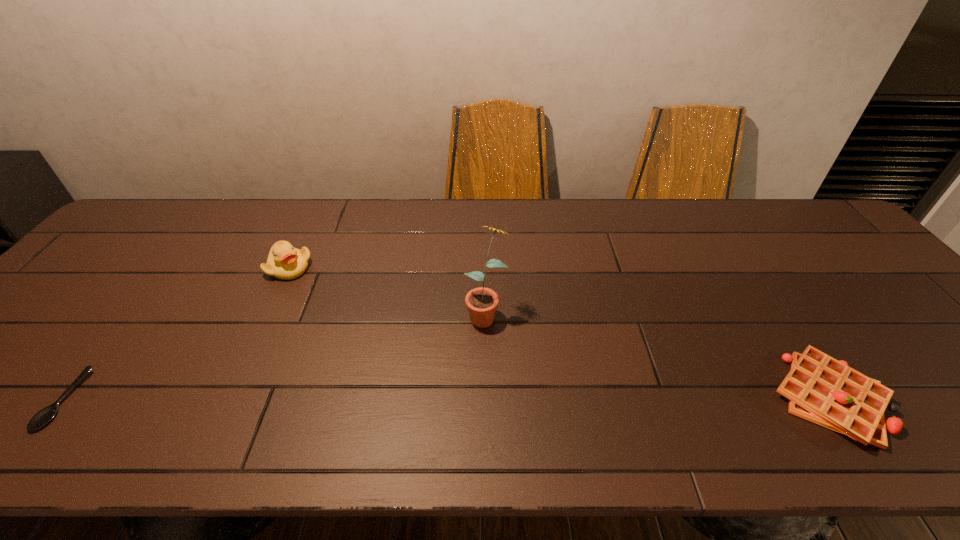
Image resolution: width=960 pixels, height=540 pixels. What are the coordinates of `the leftmost object` in the screenshot? It's located at (41, 418).

This screenshot has height=540, width=960. What are the coordinates of `the shortest object` in the screenshot? It's located at (41, 418).

The height and width of the screenshot is (540, 960). Find the location of `the rightmost object`. the rightmost object is located at coordinates (821, 389).

At what (x,y) coordinates should I click in order to perform the action: click on waffle. Please return your answer as a coordinate pair (x, y). This screenshot has height=540, width=960. Looking at the image, I should click on [821, 389].

Identify the location of the second farthest object. This screenshot has width=960, height=540. (481, 302).

The width and height of the screenshot is (960, 540). What are the coordinates of `sunflower` in the screenshot? It's located at (481, 302).

The width and height of the screenshot is (960, 540). I want to click on the second object from left to right, so click(285, 262).

Locate an element on the screen. This screenshot has width=960, height=540. duckling is located at coordinates (285, 262).

Locate an element on the screen. The width and height of the screenshot is (960, 540). free space located on the back of the leftmost object is located at coordinates tap(116, 332).

I want to click on vacant space located 0.370m on the back of the waffle, so click(732, 251).